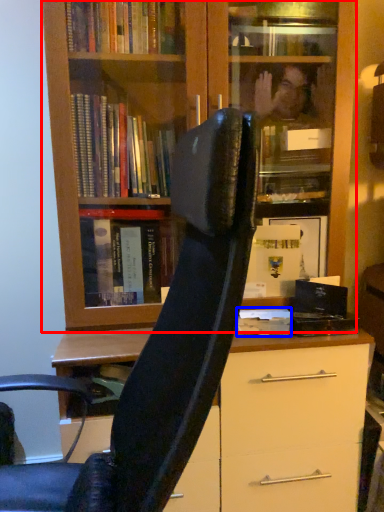
Question: Among these objects, which one is nearest to the camera, bookcase (highlighted by a red box) or paperback book (highlighted by a blue box)?

Choices:
 (A) bookcase
 (B) paperback book

Answer: (A)